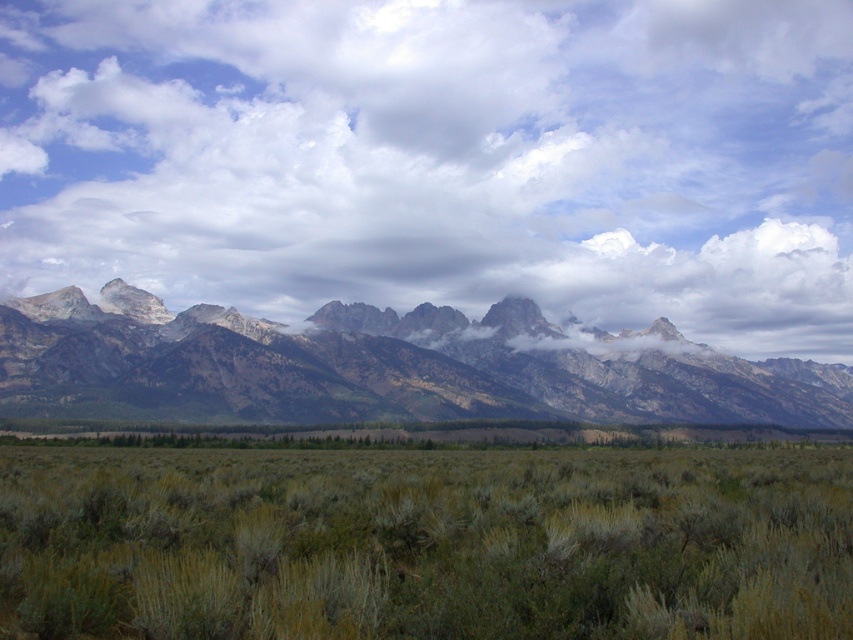
Is cloudy sky at upper center further to camera compared to gray rock mountain range at center?

That is True.

Based on the photo, does cloudy sky at upper center have a larger size compared to gray rock mountain range at center?

Correct, cloudy sky at upper center is larger in size than gray rock mountain range at center.

Which is in front, point (451, 148) or point (283, 346)?

Positioned in front is point (283, 346).

Locate an element on the screen. The image size is (853, 640). cloudy sky at upper center is located at coordinates (440, 157).

Can you confirm if cloudy sky at upper center is positioned above green shrubbery at center?

Indeed, cloudy sky at upper center is positioned over green shrubbery at center.

In the scene shown: Is cloudy sky at upper center behind green shrubbery at center?

Yes, cloudy sky at upper center is behind green shrubbery at center.

The width and height of the screenshot is (853, 640). I want to click on cloudy sky at upper center, so click(440, 157).

Is green shrubbery at center smaller than gray rock mountain range at center?

Yes, green shrubbery at center is smaller than gray rock mountain range at center.

Is point (486, 541) closer to camera compared to point (764, 387)?

Yes.

Between point (529, 515) and point (85, 358), which one is positioned in front?

Positioned in front is point (529, 515).

You are a GUI agent. You are given a task and a screenshot of the screen. Output one action in this format:
    pyautogui.click(x=<x>, y=<y>)
    Task: Click on the green shrubbery at center
    
    Given the screenshot: What is the action you would take?
    click(424, 544)